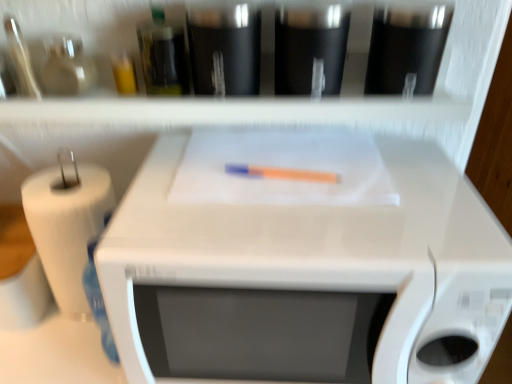
This screenshot has height=384, width=512. Find the location of `free space to the left of orange matte crayon at center`. free space to the left of orange matte crayon at center is located at coordinates (190, 179).